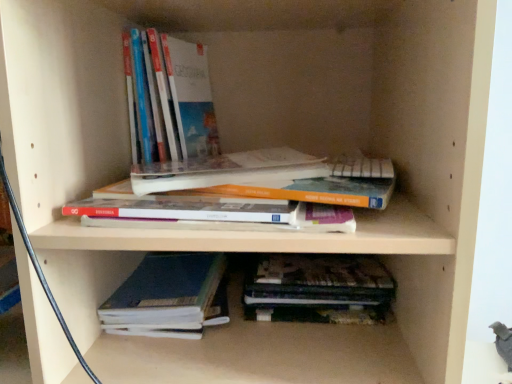
Question: From a real-world perspective, is hardcover book at center, the 2th book when ordered from top to bottom, below dark blue hardcover book at lower center, the fourth book from the top?

Choices:
 (A) yes
 (B) no

Answer: (B)

Question: Is hardcover book at center, the 2th book when ordered from top to bottom, next to dark blue hardcover book at lower center, marked as the 1th book in a bottom-to-top arrangement, and touching it?

Choices:
 (A) no
 (B) yes

Answer: (A)

Question: Is hardcover book at center, positioned as the 3th book in bottom-to-top order, at the right side of dark blue hardcover book at lower center, marked as the 1th book in a bottom-to-top arrangement?

Choices:
 (A) yes
 (B) no

Answer: (A)

Question: Does hardcover book at center, the 2th book when ordered from top to bottom, have a greater height compared to dark blue hardcover book at lower center, marked as the 1th book in a bottom-to-top arrangement?

Choices:
 (A) yes
 (B) no

Answer: (A)

Question: From the image's perspective, is hardcover book at center, positioned as the 3th book in bottom-to-top order, on top of dark blue hardcover book at lower center, the fourth book from the top?

Choices:
 (A) no
 (B) yes

Answer: (B)

Question: Considering the positions of hardcover book at center, positioned as the 3th book in bottom-to-top order, and hardcover book at upper left, which is the 1th book from top to bottom, in the image, is hardcover book at center, positioned as the 3th book in bottom-to-top order, wider or thinner than hardcover book at upper left, which is the 1th book from top to bottom,?

Choices:
 (A) wide
 (B) thin

Answer: (A)

Question: Is hardcover book at center, the 2th book when ordered from top to bottom, inside or outside of hardcover book at upper left, which appears as the 4th book when ordered from the bottom?

Choices:
 (A) inside
 (B) outside

Answer: (B)

Question: Visually, is hardcover book at center, positioned as the 3th book in bottom-to-top order, positioned to the left or to the right of hardcover book at upper left, which appears as the 4th book when ordered from the bottom?

Choices:
 (A) left
 (B) right

Answer: (B)

Question: Considering the positions of hardcover book at center, the 2th book when ordered from top to bottom, and hardcover book at upper left, which is the 1th book from top to bottom, in the image, is hardcover book at center, the 2th book when ordered from top to bottom, bigger or smaller than hardcover book at upper left, which is the 1th book from top to bottom,?

Choices:
 (A) big
 (B) small

Answer: (A)

Question: Is dark blue hardcover book at lower center, the fourth book from the top, inside or outside of dark brown leather book at lower center, which is counted as the second book, starting from the bottom?

Choices:
 (A) inside
 (B) outside

Answer: (B)

Question: In the image, is dark blue hardcover book at lower center, marked as the 1th book in a bottom-to-top arrangement, positioned in front of or behind dark brown leather book at lower center, which appears as the 3th book when viewed from the top?

Choices:
 (A) behind
 (B) front

Answer: (B)

Question: Looking at the image, does dark blue hardcover book at lower center, the fourth book from the top, seem bigger or smaller compared to dark brown leather book at lower center, which appears as the 3th book when viewed from the top?

Choices:
 (A) big
 (B) small

Answer: (A)

Question: In terms of width, does dark blue hardcover book at lower center, marked as the 1th book in a bottom-to-top arrangement, look wider or thinner when compared to dark brown leather book at lower center, which appears as the 3th book when viewed from the top?

Choices:
 (A) wide
 (B) thin

Answer: (A)

Question: From a real-world perspective, is dark brown leather book at lower center, which is counted as the second book, starting from the bottom, above or below hardcover book at center, the 2th book when ordered from top to bottom?

Choices:
 (A) below
 (B) above

Answer: (A)

Question: Is dark brown leather book at lower center, which appears as the 3th book when viewed from the top, situated inside hardcover book at center, the 2th book when ordered from top to bottom, or outside?

Choices:
 (A) inside
 (B) outside

Answer: (B)